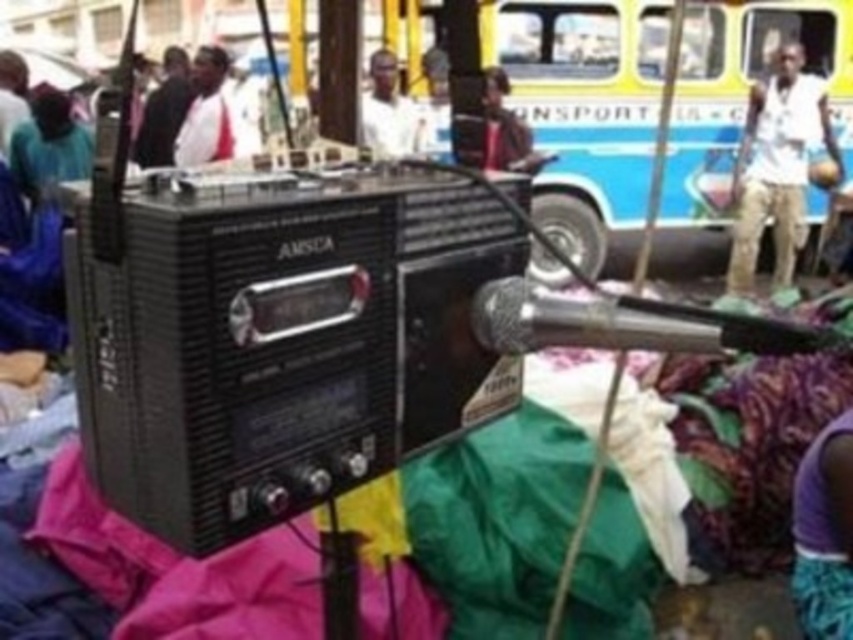
Question: Is silver metallic microphone at center in front of purple fabric at lower right?

Choices:
 (A) yes
 (B) no

Answer: (A)

Question: Estimate the real-world distances between objects in this image. Which object is farther from the silver metallic microphone at center?

Choices:
 (A) matte brown shirt at center
 (B) purple fabric at lower right
 (C) matte black radio at lower left
 (D) blue painted metal bus at center

Answer: (D)

Question: Where is blue painted metal bus at center located in relation to white matte shirt at upper center in the image?

Choices:
 (A) left
 (B) right

Answer: (B)

Question: Which point appears closest to the camera in this image?

Choices:
 (A) (508, 310)
 (B) (520, 156)
 (C) (683, 116)

Answer: (A)

Question: Estimate the real-world distances between objects in this image. Which object is farther from the silver metallic microphone at center?

Choices:
 (A) white cotton shirt at upper right
 (B) matte brown shirt at center

Answer: (A)

Question: Is silver metallic microphone at center further to the viewer compared to purple fabric at lower right?

Choices:
 (A) yes
 (B) no

Answer: (B)